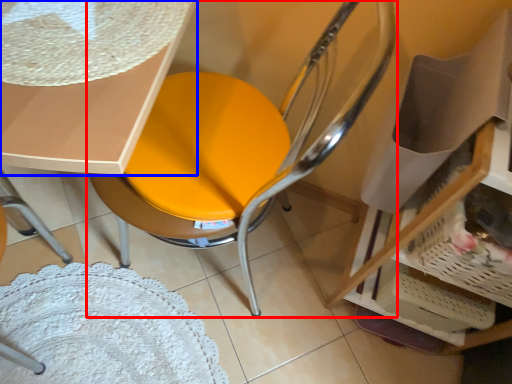
Question: Which object is closer to the camera taking this photo, chair (highlighted by a red box) or table (highlighted by a blue box)?

Choices:
 (A) chair
 (B) table

Answer: (A)